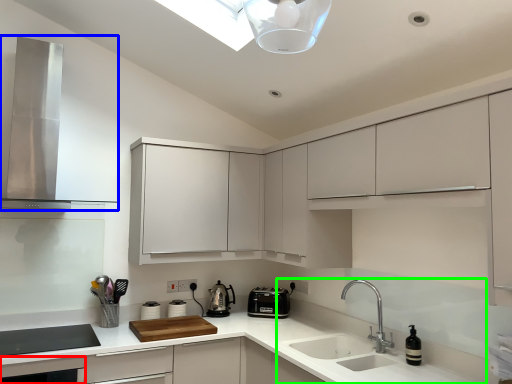
Question: Which object is the closest to the dish washer (highlighted by a red box)? Choose among these: home appliance (highlighted by a blue box) or sink (highlighted by a green box).

Choices:
 (A) home appliance
 (B) sink

Answer: (A)